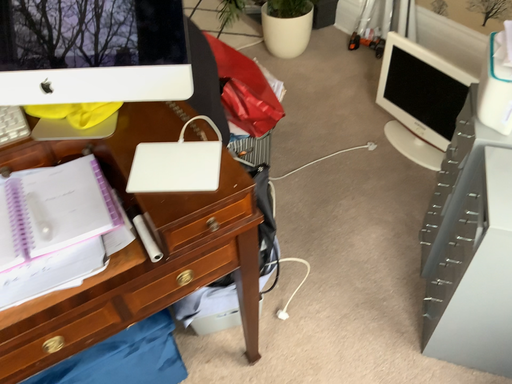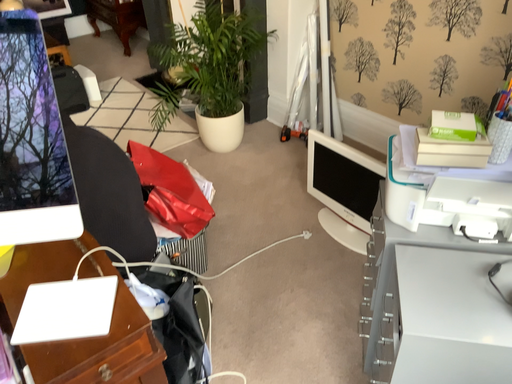
Question: Which way did the camera rotate in the video?

Choices:
 (A) rotated downward
 (B) rotated upward

Answer: (B)